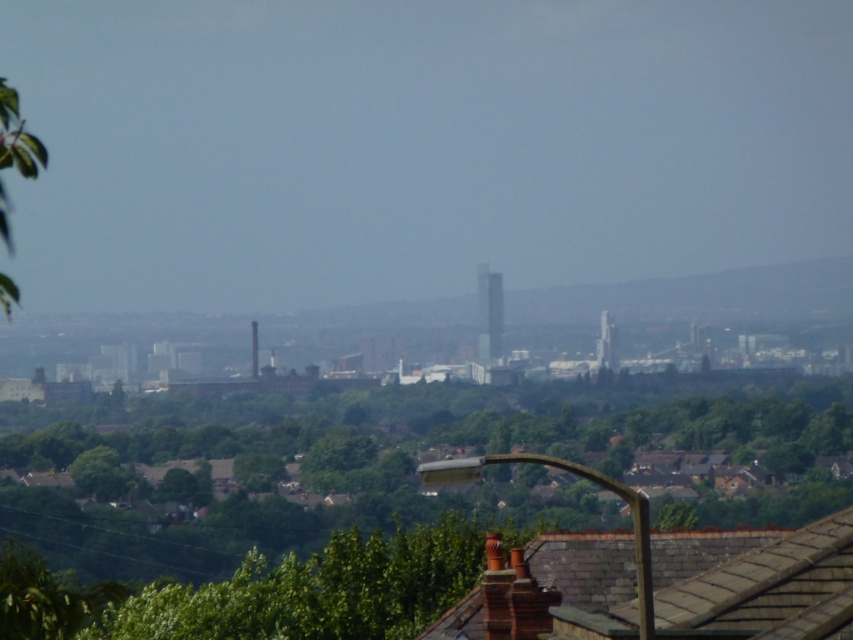
You are a city planner assessing the view from a new observation deck. You notice the green leafy tree at center and the black glass chimney at center. Which object appears bigger in the scene?

The green leafy tree at center appears larger than the black glass chimney at center in the scene.